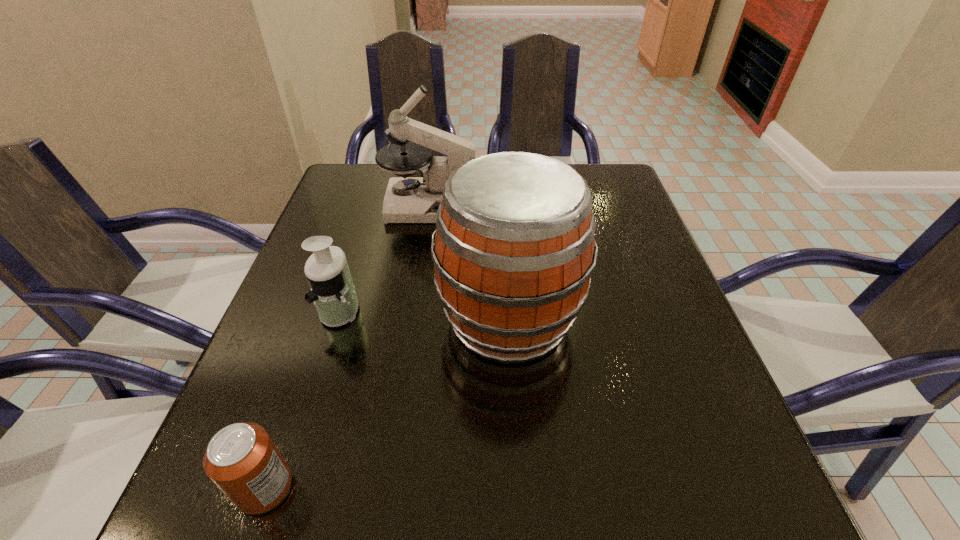
Identify the location of microscope. (407, 199).

You are a GUI agent. You are given a task and a screenshot of the screen. Output one action in this format:
    pyautogui.click(x=<x>, y=<y>)
    Task: Click on the cider
    The height and width of the screenshot is (540, 960).
    Given the screenshot: What is the action you would take?
    pyautogui.click(x=514, y=250)

Identify the location of juicer. (332, 290).

At what (x,y) coordinates should I click in order to perform the action: click on the shortest object. Please return your answer as a coordinate pair (x, y). The width and height of the screenshot is (960, 540). Looking at the image, I should click on point(241,459).

Identify the location of can. Image resolution: width=960 pixels, height=540 pixels. (241, 459).

I want to click on free space located at the eyepiece of the microscope, so click(x=594, y=205).

Image resolution: width=960 pixels, height=540 pixels. I want to click on free region located 0.140m on the front of the cider, so click(517, 459).

This screenshot has width=960, height=540. In order to click on vacant region located on the front of the third tallest object in this screenshot , I will do `click(286, 483)`.

Locate an element on the screen. Image resolution: width=960 pixels, height=540 pixels. free space located on the back of the can is located at coordinates (313, 348).

Find the location of a particular element. The width and height of the screenshot is (960, 540). object present at the far edge is located at coordinates (407, 199).